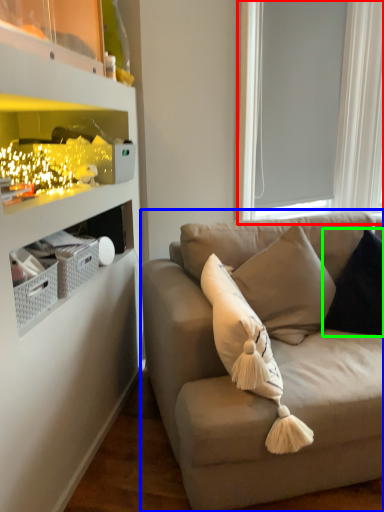
Question: Estimate the real-world distances between objects in this image. Which object is farther from window screen (highlighted by a red box), studio couch (highlighted by a blue box) or pillow (highlighted by a green box)?

Choices:
 (A) studio couch
 (B) pillow

Answer: (A)